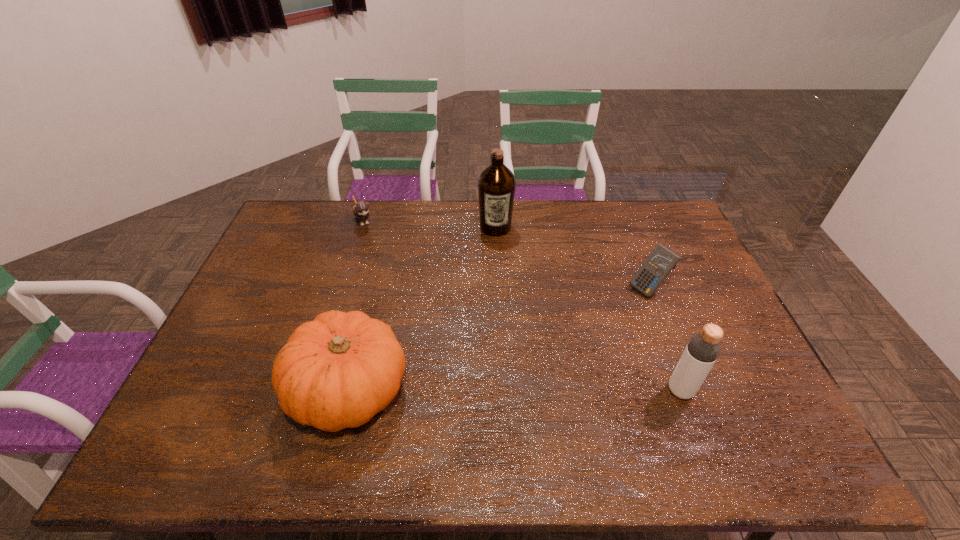
Identify which object is the third nearest to the bottle. Please provide its 2D coordinates. Your answer should be formatted as a tuple, i.e. [(x, y)], where the tuple contains the x and y coordinates of a point satisfying the conditions above.

[(496, 185)]